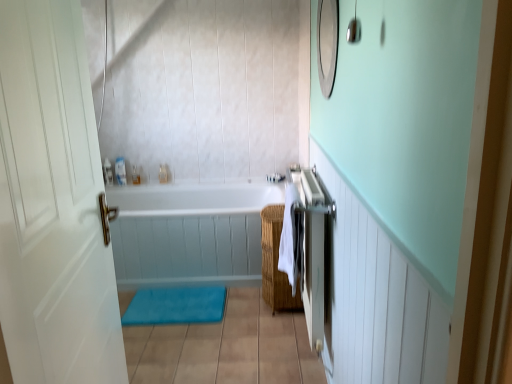
Question: Is translucent plastic soap dispenser at upper center, marked as the 2th toiletry in a left-to-right arrangement, positioned far away from white matte door at left?

Choices:
 (A) yes
 (B) no

Answer: (A)

Question: From a real-world perspective, is translucent plastic soap dispenser at upper center, which ranks as the second toiletry in right-to-left order, positioned under white matte door at left based on gravity?

Choices:
 (A) yes
 (B) no

Answer: (A)

Question: Considering the relative sizes of translucent plastic soap dispenser at upper center, which ranks as the second toiletry in right-to-left order, and white matte door at left in the image provided, is translucent plastic soap dispenser at upper center, which ranks as the second toiletry in right-to-left order, taller than white matte door at left?

Choices:
 (A) no
 (B) yes

Answer: (A)

Question: From the image's perspective, is translucent plastic soap dispenser at upper center, which ranks as the second toiletry in right-to-left order, on top of white matte door at left?

Choices:
 (A) yes
 (B) no

Answer: (A)

Question: Does translucent plastic soap dispenser at upper center, marked as the 2th toiletry in a left-to-right arrangement, lie in front of white matte door at left?

Choices:
 (A) yes
 (B) no

Answer: (B)

Question: Could you tell me if translucent plastic soap dispenser at upper center, which ranks as the second toiletry in right-to-left order, is facing white matte door at left?

Choices:
 (A) yes
 (B) no

Answer: (B)

Question: Is blue fabric bath mat at lower center touching white matte door at left?

Choices:
 (A) yes
 (B) no

Answer: (B)

Question: From a real-world perspective, is blue fabric bath mat at lower center under white matte door at left?

Choices:
 (A) no
 (B) yes

Answer: (B)

Question: Considering the relative positions of blue fabric bath mat at lower center and white matte door at left in the image provided, is blue fabric bath mat at lower center behind white matte door at left?

Choices:
 (A) yes
 (B) no

Answer: (A)

Question: Is blue fabric bath mat at lower center surrounding white matte door at left?

Choices:
 (A) yes
 (B) no

Answer: (B)

Question: Does blue fabric bath mat at lower center appear on the right side of white matte door at left?

Choices:
 (A) yes
 (B) no

Answer: (B)

Question: Considering the relative positions of blue fabric bath mat at lower center and white matte door at left in the image provided, is blue fabric bath mat at lower center to the left of white matte door at left from the viewer's perspective?

Choices:
 (A) yes
 (B) no

Answer: (A)

Question: Is the surface of woven brown basket at center in direct contact with blue fabric bath mat at lower center?

Choices:
 (A) no
 (B) yes

Answer: (A)